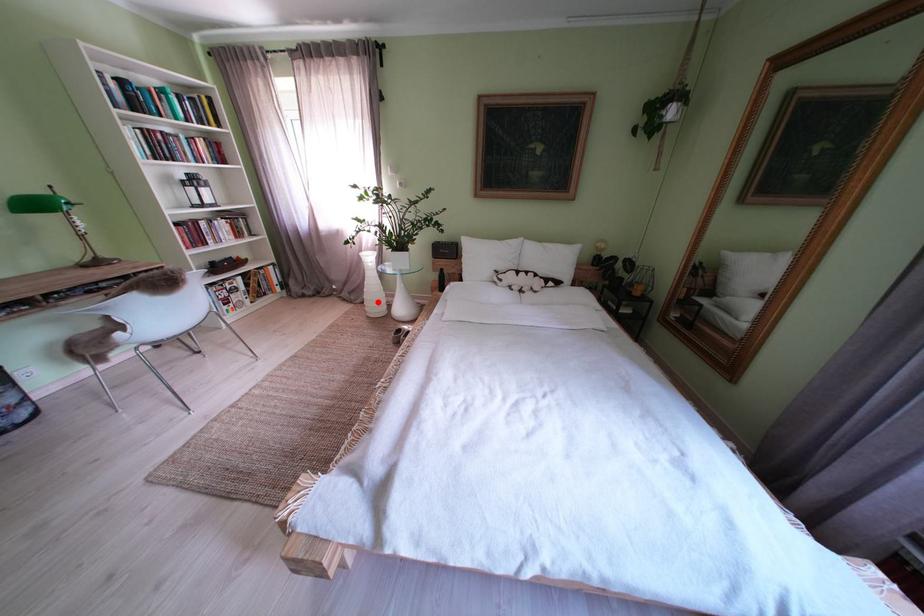
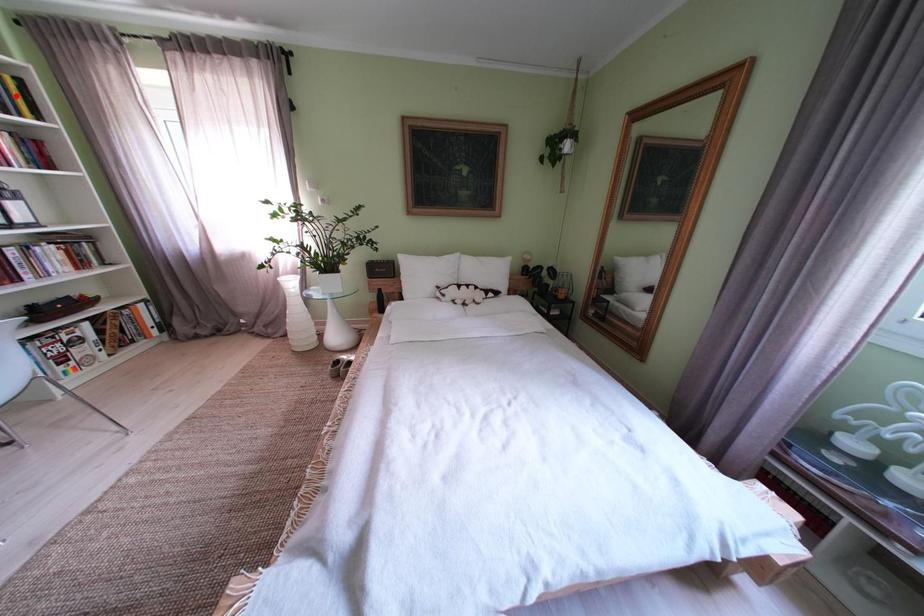
I am providing you with two images of the same scene from different viewpoints. A red point is marked on the first image and another point is marked on the second image. Is the marked point in image1 the same physical position as the marked point in image2?

No